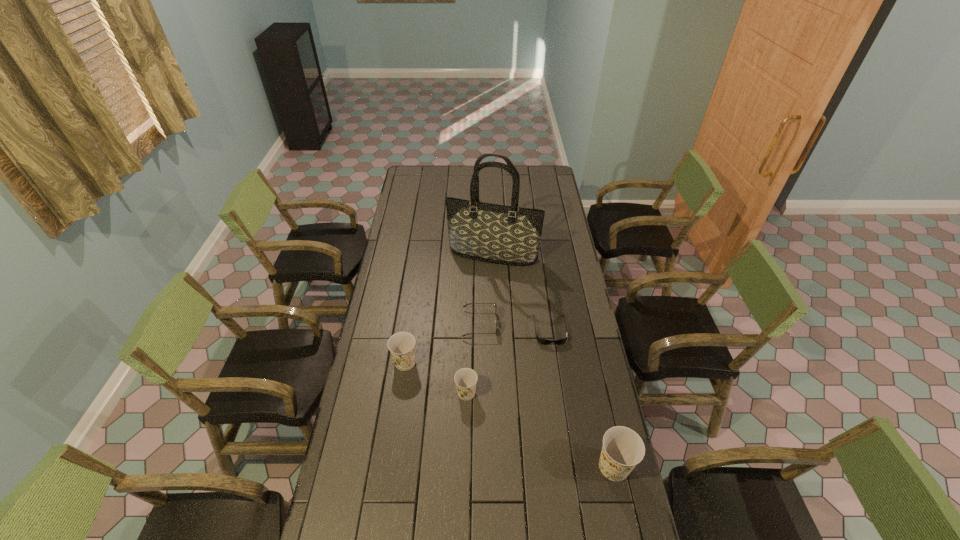
Identify the location of the fourth shortest object. (402, 344).

Find the location of a particular element. the leftmost object is located at coordinates (402, 344).

I want to click on the second Dixie cup from right to left, so click(465, 378).

Image resolution: width=960 pixels, height=540 pixels. I want to click on the shortest Dixie cup, so click(465, 378).

Find the location of a particular element. the rightmost Dixie cup is located at coordinates (623, 448).

Where is `the tallest Dixie cup`? The width and height of the screenshot is (960, 540). the tallest Dixie cup is located at coordinates (623, 448).

Locate an element on the screen. This screenshot has width=960, height=540. the shortest object is located at coordinates (542, 341).

Locate an element on the screen. The image size is (960, 540). the right sunglasses is located at coordinates (542, 341).

The height and width of the screenshot is (540, 960). In order to click on the taller sunglasses in this screenshot , I will do `click(469, 303)`.

Image resolution: width=960 pixels, height=540 pixels. What are the coordinates of `the left sunglasses` in the screenshot? It's located at pyautogui.click(x=469, y=303).